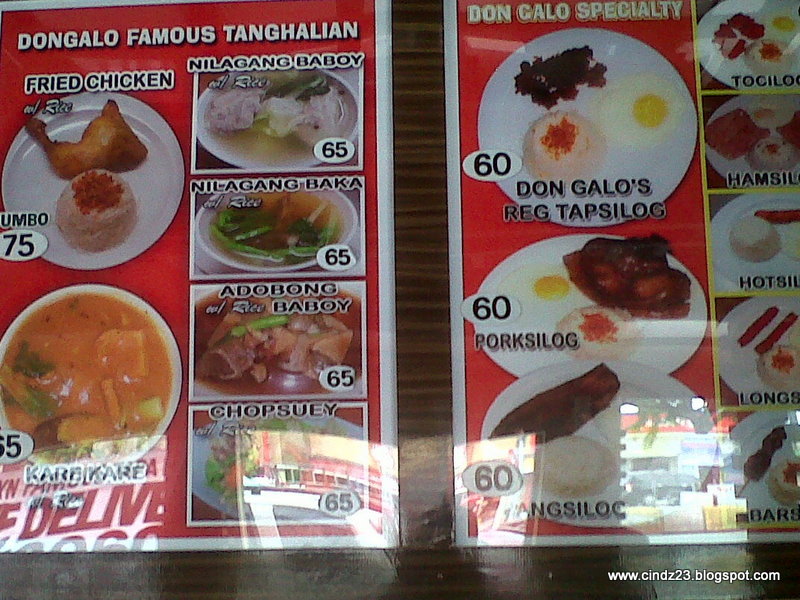
Where is `white plates`? The width and height of the screenshot is (800, 600). white plates is located at coordinates (162, 167), (200, 493), (510, 119), (682, 321), (662, 387), (738, 374), (750, 426), (722, 223), (721, 163), (720, 76).